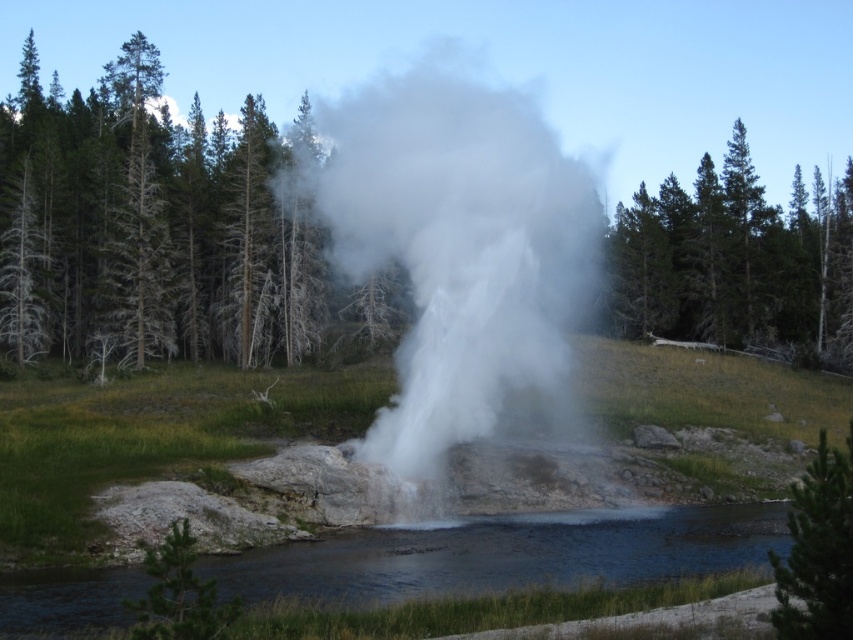
Does point (109, 600) come behind point (700, 180)?

No, it is not.

Is point (22, 600) less distant than point (630, 330)?

Yes, it is in front of point (630, 330).

Find the location of a particular element. This screenshot has width=853, height=640. clear water at lower center is located at coordinates (505, 554).

Locate an element on the screen. clear water at lower center is located at coordinates (505, 554).

Does green leafy tree at upper right have a lesser height compared to green textured pine tree at lower right?

Incorrect, green leafy tree at upper right's height does not fall short of green textured pine tree at lower right's.

From the picture: Can you confirm if green leafy tree at upper right is thinner than green textured pine tree at lower right?

No.

Which is behind, point (701, 259) or point (824, 544)?

The point (701, 259) is more distant.

Locate an element on the screen. green leafy tree at upper right is located at coordinates point(735,262).

Who is more distant from viewer, (450,218) or (833,243)?

The point (833,243) is more distant.

The height and width of the screenshot is (640, 853). Describe the element at coordinates (461, 259) in the screenshot. I see `white vapor at center` at that location.

What do you see at coordinates (461, 259) in the screenshot? This screenshot has height=640, width=853. I see `white vapor at center` at bounding box center [461, 259].

You are a GUI agent. You are given a task and a screenshot of the screen. Output one action in this format:
    pyautogui.click(x=<x>, y=<y>)
    Task: Click on the white vapor at center
    
    Given the screenshot: What is the action you would take?
    coord(461,259)